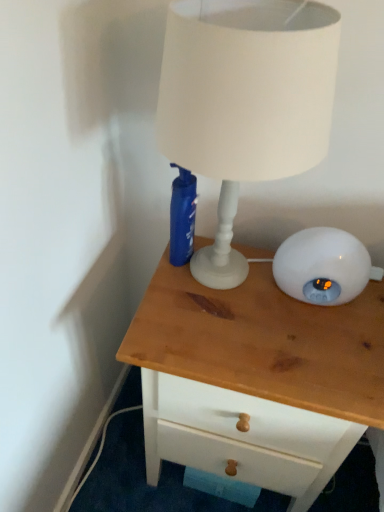
Question: Is wooden chest of drawers at center bigger or smaller than white matte lampshade at upper center?

Choices:
 (A) small
 (B) big

Answer: (B)

Question: Choose the correct answer: Is wooden chest of drawers at center inside white matte lampshade at upper center or outside it?

Choices:
 (A) outside
 (B) inside

Answer: (A)

Question: From their relative heights in the image, would you say wooden chest of drawers at center is taller or shorter than white matte lampshade at upper center?

Choices:
 (A) tall
 (B) short

Answer: (A)

Question: Is point (244, 29) positioned closer to the camera than point (367, 354)?

Choices:
 (A) farther
 (B) closer

Answer: (B)

Question: Would you say white matte lampshade at upper center is inside or outside wooden chest of drawers at center?

Choices:
 (A) inside
 (B) outside

Answer: (B)

Question: Is white matte lampshade at upper center taller or shorter than wooden chest of drawers at center?

Choices:
 (A) short
 (B) tall

Answer: (A)

Question: From a real-world perspective, is white matte lampshade at upper center above or below wooden chest of drawers at center?

Choices:
 (A) above
 (B) below

Answer: (A)